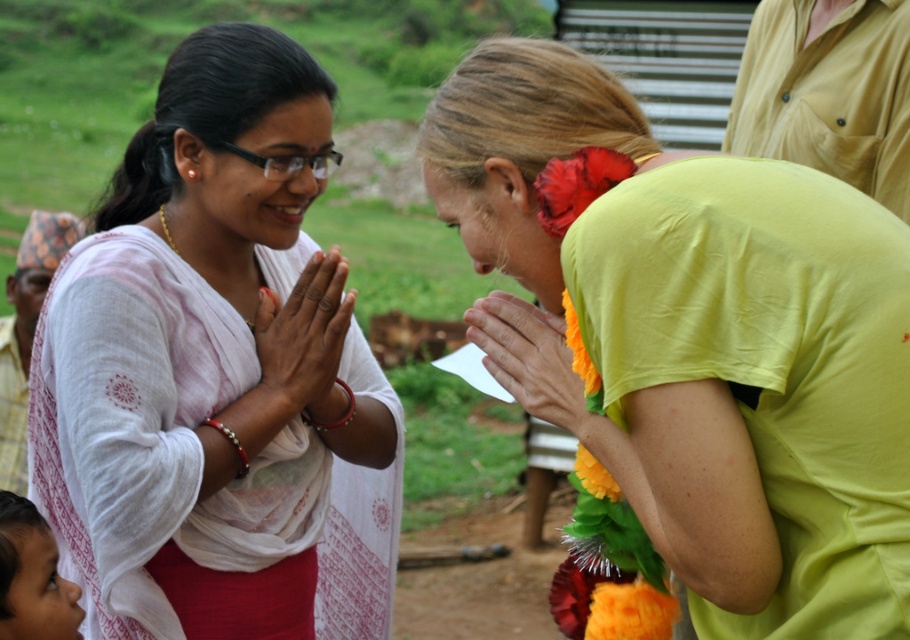
Can you confirm if white sheer sari at center is taller than smooth skin face at lower left?

Correct, white sheer sari at center is much taller as smooth skin face at lower left.

What do you see at coordinates (206, 358) in the screenshot? This screenshot has width=910, height=640. I see `white sheer sari at center` at bounding box center [206, 358].

Who is more forward, (310, 445) or (5, 508)?

Point (5, 508) is more forward.

You are a GUI agent. You are given a task and a screenshot of the screen. Output one action in this format:
    pyautogui.click(x=<x>, y=<y>)
    Task: Click on the white sheer sari at center
    
    Given the screenshot: What is the action you would take?
    pyautogui.click(x=206, y=358)

Does yellow cotton shirt at center appear on the right side of smooth skin face at lower left?

Correct, you'll find yellow cotton shirt at center to the right of smooth skin face at lower left.

Locate an element on the screen. yellow cotton shirt at center is located at coordinates (694, 337).

Between orange fabric at center and smooth skin face at lower left, which one is positioned lower?

smooth skin face at lower left

Based on the photo, is orange fabric at center to the left of smooth skin face at lower left from the viewer's perspective?

No, orange fabric at center is not to the left of smooth skin face at lower left.

Between point (575, 429) and point (18, 605), which one is positioned in front?

Point (575, 429)

Locate an element on the screen. Image resolution: width=910 pixels, height=640 pixels. orange fabric at center is located at coordinates (528, 356).